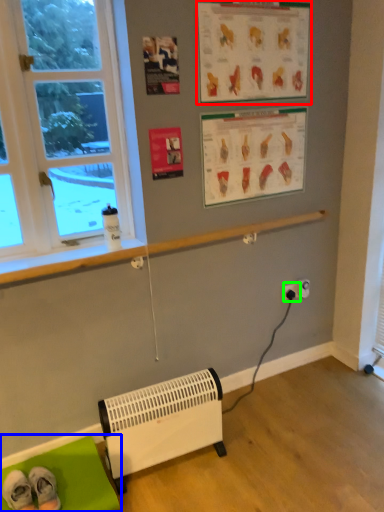
Question: Which object is positioned farthest from writing (highlighted by a red box)? Select from furniture (highlighted by a blue box) and electric outlet (highlighted by a green box).

Choices:
 (A) furniture
 (B) electric outlet

Answer: (A)